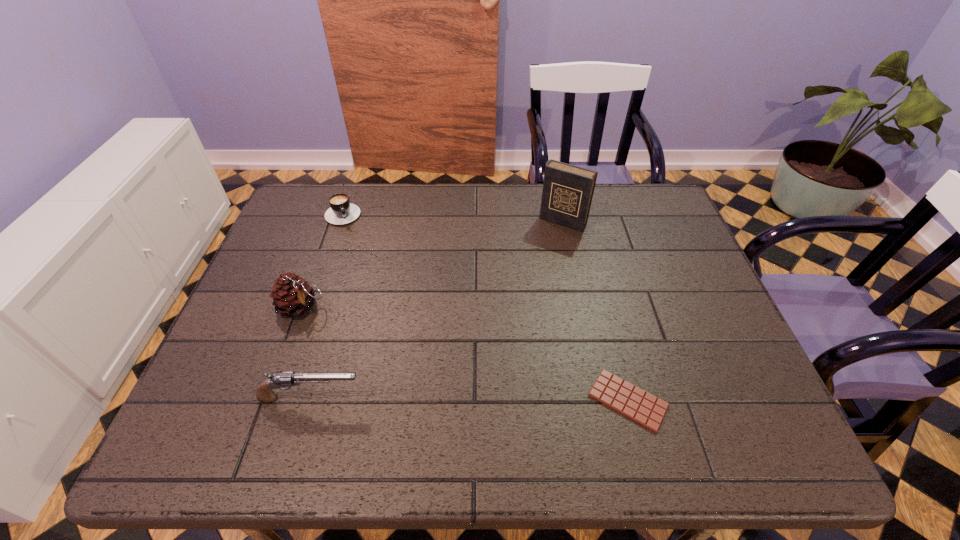
This screenshot has width=960, height=540. I want to click on vacant region located with a leaf charm attached to the pinecone, so click(369, 343).

What are the coordinates of `vacant space situated 0.200m with the handle on the side of the second shortest object` in the screenshot? It's located at (366, 267).

Locate an element on the screen. The image size is (960, 540). free spot located with the handle on the side of the second shortest object is located at coordinates (372, 281).

The width and height of the screenshot is (960, 540). I want to click on free location located 0.120m with the handle on the side of the second shortest object, so 358,249.

The height and width of the screenshot is (540, 960). In order to click on vacant space located 0.060m on the front cover of the diary in this screenshot , I will do `click(545, 243)`.

Where is `vacant space located on the front cover of the diary`? The image size is (960, 540). vacant space located on the front cover of the diary is located at coordinates (540, 251).

Where is `free location located 0.370m on the front cover of the diary`? The height and width of the screenshot is (540, 960). free location located 0.370m on the front cover of the diary is located at coordinates (496, 317).

Identify the location of cappuccino at the far edge. The image size is (960, 540). (341, 211).

Find the location of `diary positioned at the far edge`. diary positioned at the far edge is located at coordinates (567, 194).

Locate an element on the screen. The height and width of the screenshot is (540, 960). gun at the near edge is located at coordinates (264, 392).